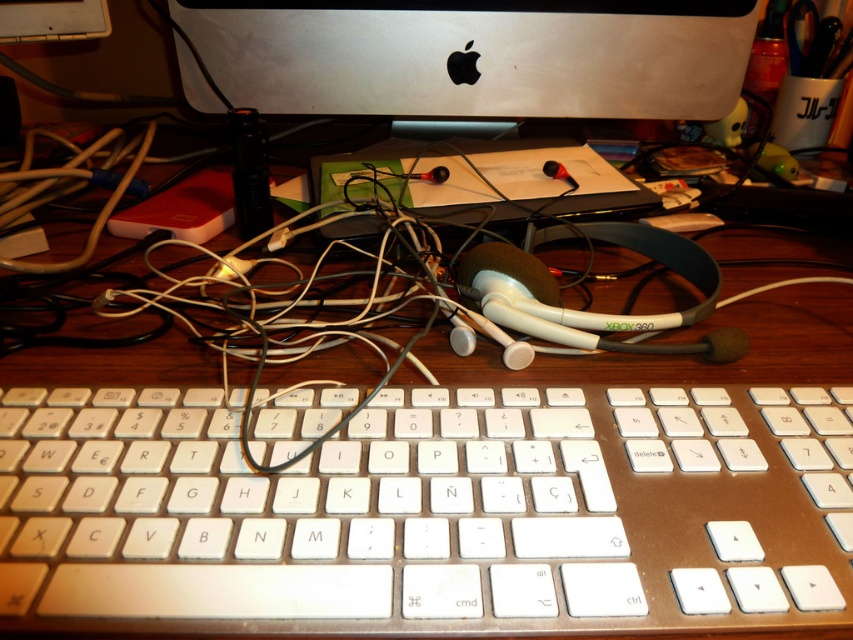
Question: Can you confirm if white plastic keyboard at center is wider than sleek silver monitor at upper center?

Choices:
 (A) yes
 (B) no

Answer: (B)

Question: Which point is closer to the camera?

Choices:
 (A) white plastic keyboard at center
 (B) sleek silver monitor at upper center

Answer: (A)

Question: Does white plastic keyboard at center appear on the left side of sleek silver monitor at upper center?

Choices:
 (A) yes
 (B) no

Answer: (A)

Question: Is white plastic keyboard at center closer to the viewer compared to sleek silver monitor at upper center?

Choices:
 (A) yes
 (B) no

Answer: (A)

Question: Which of the following is the farthest from the observer?

Choices:
 (A) (117, 504)
 (B) (675, 61)

Answer: (B)